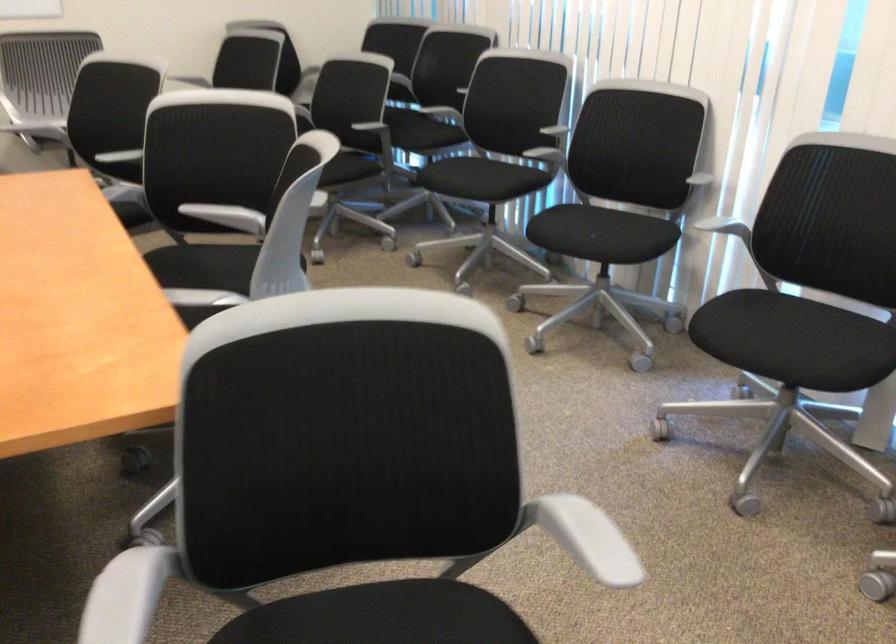
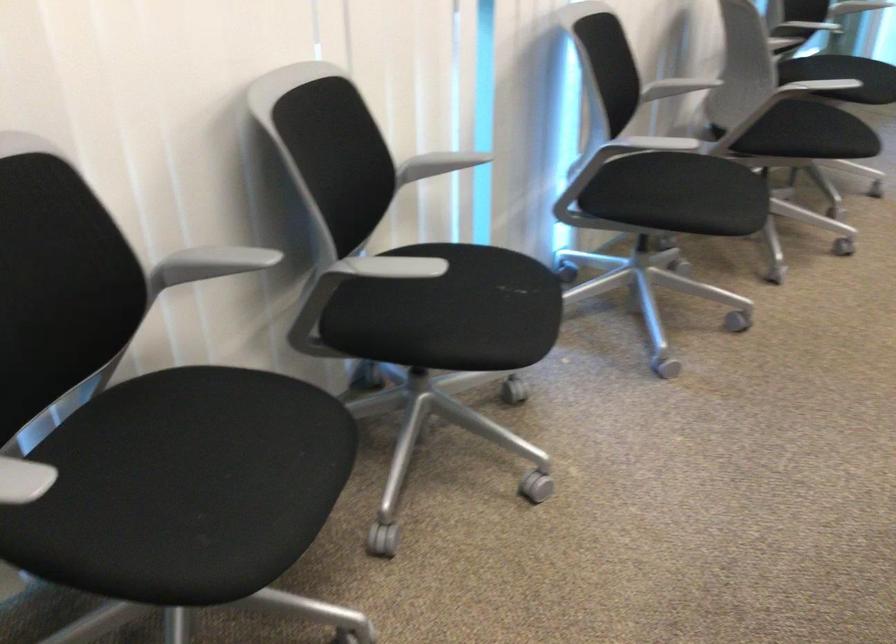
Where in the second image is the point corresponding to pixel 693 182 from the first image?

(438, 164)